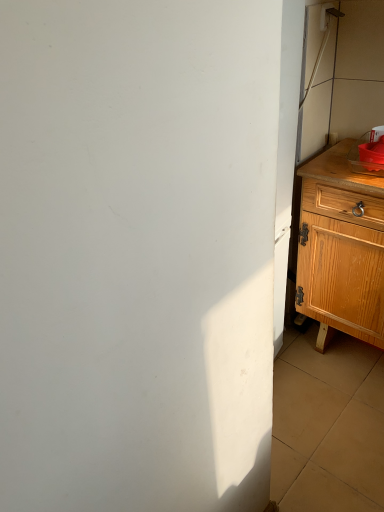
Question: In the image, is light brown wooden chest of drawers at right positioned in front of or behind matte plastic sink at right?

Choices:
 (A) front
 (B) behind

Answer: (A)

Question: From the image's perspective, is light brown wooden chest of drawers at right above or below matte plastic sink at right?

Choices:
 (A) above
 (B) below

Answer: (B)

Question: Considering the positions of point (382, 229) and point (352, 160), is point (382, 229) closer or farther from the camera than point (352, 160)?

Choices:
 (A) farther
 (B) closer

Answer: (B)

Question: From the image's perspective, is matte plastic sink at right above or below light brown wooden chest of drawers at right?

Choices:
 (A) below
 (B) above

Answer: (B)

Question: Is point (357, 143) positioned closer to the camera than point (339, 268)?

Choices:
 (A) farther
 (B) closer

Answer: (A)

Question: Is matte plastic sink at right taller or shorter than light brown wooden chest of drawers at right?

Choices:
 (A) short
 (B) tall

Answer: (A)

Question: Considering their positions, is matte plastic sink at right located in front of or behind light brown wooden chest of drawers at right?

Choices:
 (A) front
 (B) behind

Answer: (B)